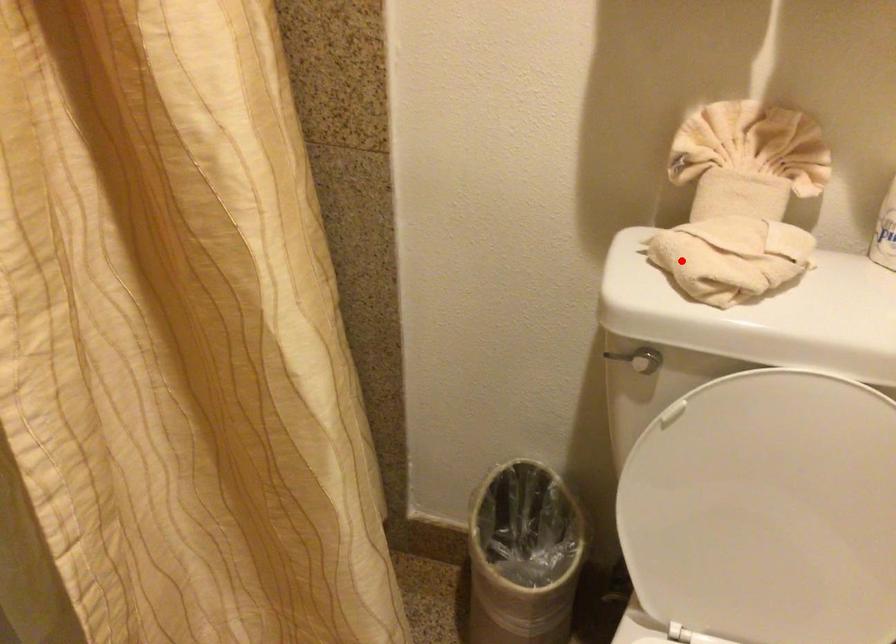
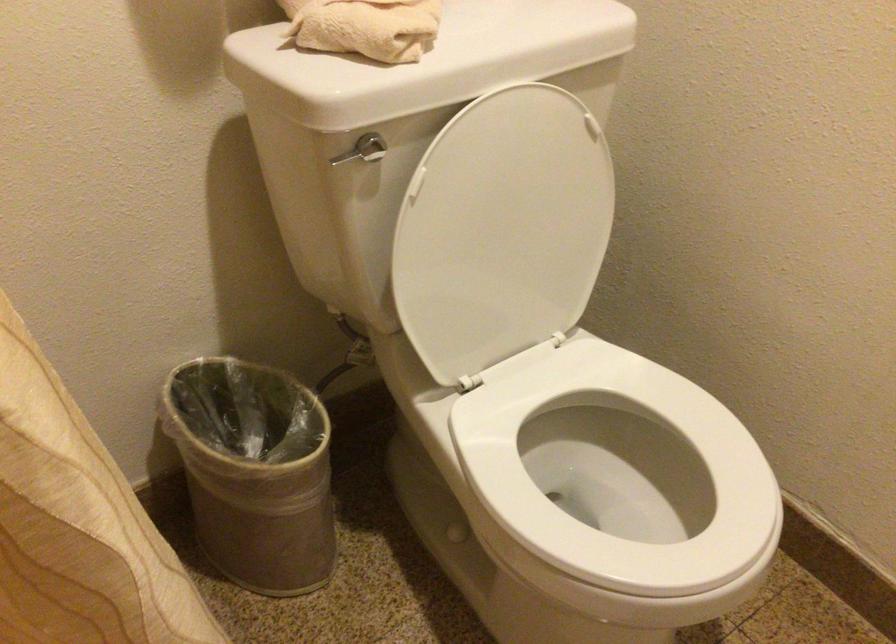
Where in the second image is the point corresponding to the highlighted location from the first image?

(365, 26)